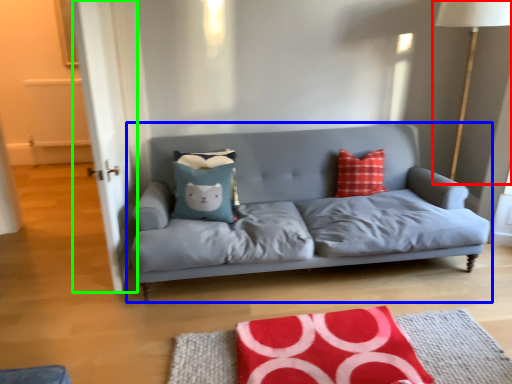
Question: Estimate the real-world distances between objects in this image. Which object is farther from table lamp (highlighted by a red box), studio couch (highlighted by a blue box) or glass door (highlighted by a green box)?

Choices:
 (A) studio couch
 (B) glass door

Answer: (B)